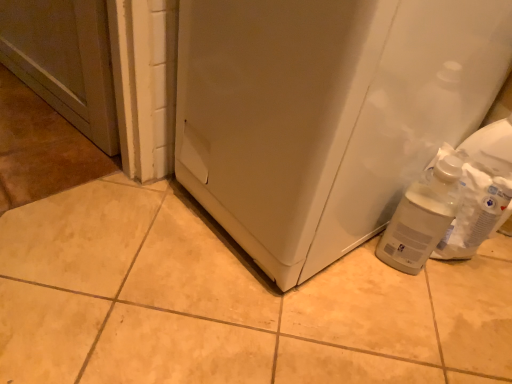
This screenshot has height=384, width=512. In order to click on white matte refrigerator at lower right in this screenshot , I will do `click(325, 113)`.

Describe the element at coordinates (325, 113) in the screenshot. I see `white matte refrigerator at lower right` at that location.

Image resolution: width=512 pixels, height=384 pixels. What are the coordinates of `translucent plastic bottle at lower right` in the screenshot? It's located at (421, 218).

The image size is (512, 384). What do you see at coordinates (421, 218) in the screenshot?
I see `translucent plastic bottle at lower right` at bounding box center [421, 218].

Identify the location of white matte refrigerator at lower right. (325, 113).

In the scene shown: Based on their positions, is white matte refrigerator at lower right located to the left or right of translucent plastic bottle at lower right?

From the image, it's evident that white matte refrigerator at lower right is to the left of translucent plastic bottle at lower right.

Which is behind, white matte refrigerator at lower right or translucent plastic bottle at lower right?

translucent plastic bottle at lower right is further away from the camera.

Does point (357, 237) appear closer or farther from the camera than point (439, 222)?

Point (357, 237) appears to be farther away from the viewer than point (439, 222).

From the image's perspective, which object appears higher, white matte refrigerator at lower right or translucent plastic bottle at lower right?

white matte refrigerator at lower right.

From a real-world perspective, is white matte refrigerator at lower right over translucent plastic bottle at lower right?

Yes, from a real-world perspective, white matte refrigerator at lower right is above translucent plastic bottle at lower right.

Is white matte refrigerator at lower right wider than translucent plastic bottle at lower right?

Yes.

Is white matte refrigerator at lower right taller than translucent plastic bottle at lower right?

Yes, white matte refrigerator at lower right is taller than translucent plastic bottle at lower right.

Does white matte refrigerator at lower right have a smaller size compared to translucent plastic bottle at lower right?

No, white matte refrigerator at lower right is not smaller than translucent plastic bottle at lower right.

Which is correct: white matte refrigerator at lower right is inside translucent plastic bottle at lower right, or outside of it?

white matte refrigerator at lower right is not inside translucent plastic bottle at lower right, it's outside.

Would you consider white matte refrigerator at lower right to be distant from translucent plastic bottle at lower right?

No.

Is white matte refrigerator at lower right positioned with its back to translucent plastic bottle at lower right?

white matte refrigerator at lower right is not turned away from translucent plastic bottle at lower right.

Identify the location of refrigerator above the translucent plastic bottle at lower right (from a real-world perspective). (325, 113).

From the picture: Considering the relative positions of translucent plastic bottle at lower right and white matte refrigerator at lower right in the image provided, is translucent plastic bottle at lower right to the left of white matte refrigerator at lower right from the viewer's perspective?

No, translucent plastic bottle at lower right is not to the left of white matte refrigerator at lower right.

Relative to white matte refrigerator at lower right, is translucent plastic bottle at lower right in front or behind?

Clearly, translucent plastic bottle at lower right is behind white matte refrigerator at lower right.

Which point is more distant from viewer, (422, 229) or (220, 34)?

The point (422, 229) is behind.

From the image's perspective, is translucent plastic bottle at lower right located above white matte refrigerator at lower right?

No, from the image's perspective, translucent plastic bottle at lower right is not above white matte refrigerator at lower right.

From a real-world perspective, is translucent plastic bottle at lower right physically below white matte refrigerator at lower right?

Yes.

Which object is wider, translucent plastic bottle at lower right or white matte refrigerator at lower right?

white matte refrigerator at lower right.

Considering the sizes of objects translucent plastic bottle at lower right and white matte refrigerator at lower right in the image provided, who is shorter, translucent plastic bottle at lower right or white matte refrigerator at lower right?

translucent plastic bottle at lower right.

Considering the sizes of objects translucent plastic bottle at lower right and white matte refrigerator at lower right in the image provided, who is bigger, translucent plastic bottle at lower right or white matte refrigerator at lower right?

white matte refrigerator at lower right is bigger.

Which is correct: translucent plastic bottle at lower right is inside white matte refrigerator at lower right, or outside of it?

translucent plastic bottle at lower right exists outside the volume of white matte refrigerator at lower right.

From the picture: Is the surface of translucent plastic bottle at lower right in direct contact with white matte refrigerator at lower right?

translucent plastic bottle at lower right and white matte refrigerator at lower right are not in contact.

Does translucent plastic bottle at lower right turn towards white matte refrigerator at lower right?

No, translucent plastic bottle at lower right is not aimed at white matte refrigerator at lower right.

Can you tell me how much translucent plastic bottle at lower right and white matte refrigerator at lower right differ in facing direction?

translucent plastic bottle at lower right and white matte refrigerator at lower right are facing 0.345 degrees away from each other.

Measure the distance between translucent plastic bottle at lower right and white matte refrigerator at lower right.

translucent plastic bottle at lower right and white matte refrigerator at lower right are 10.30 inches apart.

I want to click on bottle lying behind the white matte refrigerator at lower right, so click(x=421, y=218).

Identify the location of bottle below the white matte refrigerator at lower right (from the image's perspective). (421, 218).

Locate an element on the screen. refrigerator in front of the translucent plastic bottle at lower right is located at coordinates (325, 113).